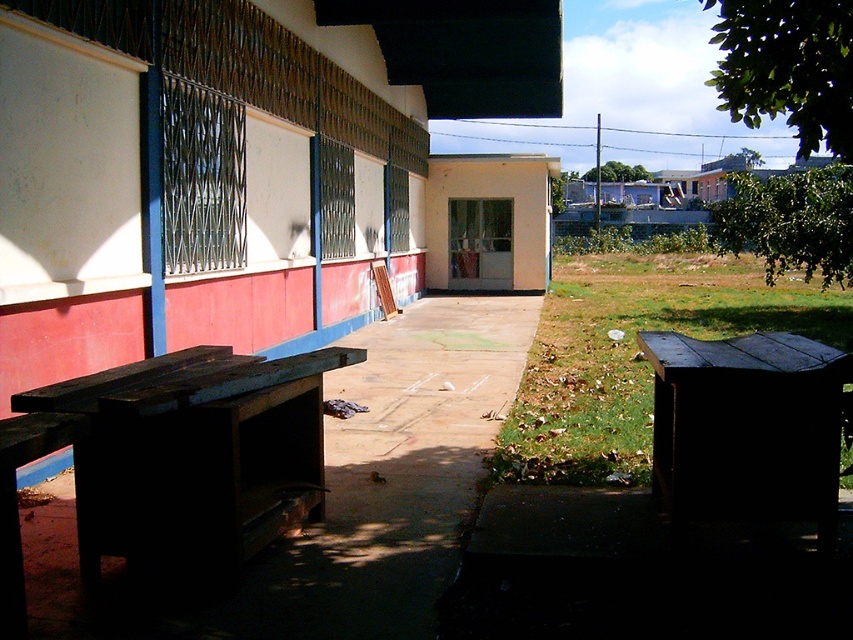
This screenshot has height=640, width=853. I want to click on dark wood picnic table at lower right, so click(747, 428).

Is dark wood picnic table at lower right to the right of beige matte hut at center from the viewer's perspective?

Incorrect, dark wood picnic table at lower right is not on the right side of beige matte hut at center.

Does point (804, 346) come farther from viewer compared to point (549, 193)?

No.

You are a GUI agent. You are given a task and a screenshot of the screen. Output one action in this format:
    pyautogui.click(x=<x>, y=<y>)
    Task: Click on the dark wood picnic table at lower right
    The image size is (853, 640).
    Given the screenshot: What is the action you would take?
    pyautogui.click(x=747, y=428)

In order to click on wooden bench at left in this screenshot , I will do `click(230, 163)`.

Is wooden bench at left wider than beige matte hut at center?

Indeed, wooden bench at left has a greater width compared to beige matte hut at center.

At what (x,y) coordinates should I click in order to perform the action: click on wooden bench at left. Please return your answer as a coordinate pair (x, y). The width and height of the screenshot is (853, 640). Looking at the image, I should click on pyautogui.click(x=230, y=163).

Does wooden bench at left come behind dark wood bench at left?

Yes, it is behind dark wood bench at left.

Who is more distant from viewer, (x=367, y=124) or (x=270, y=515)?

Positioned behind is point (x=367, y=124).

In order to click on wooden bench at left in this screenshot , I will do `click(230, 163)`.